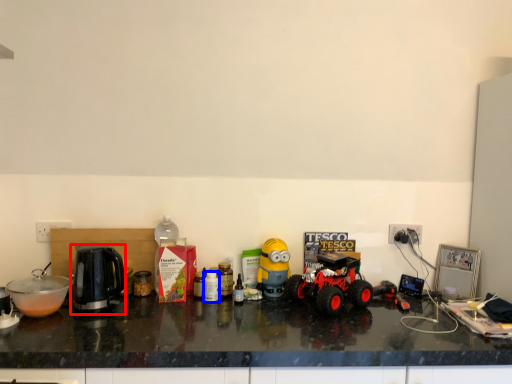
Question: Which of the following is the farthest to the observer, kettle (highlighted by a red box) or bottle (highlighted by a blue box)?

Choices:
 (A) kettle
 (B) bottle

Answer: (B)